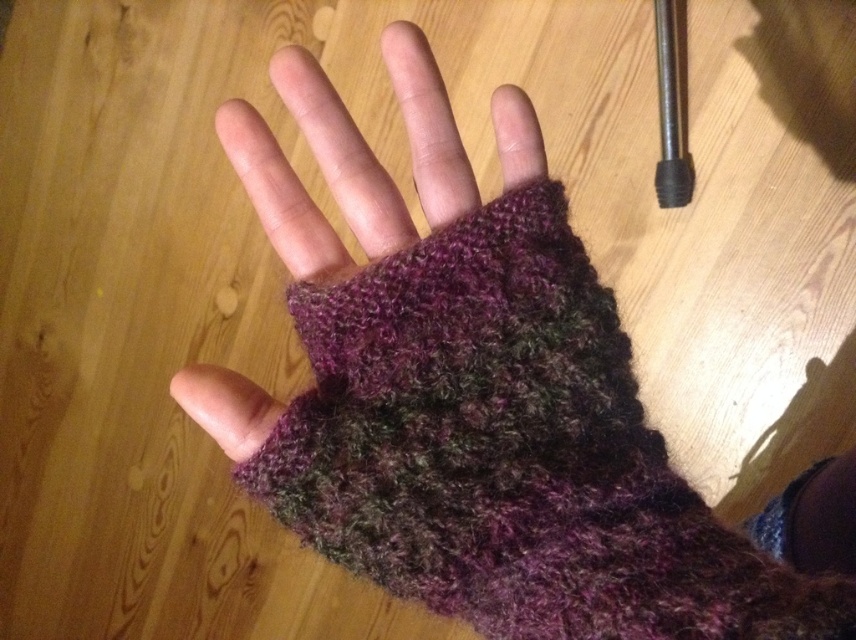
Is multicolor knitted fingerless glove at center shorter than knitted wool sock at lower right?

No, multicolor knitted fingerless glove at center is not shorter than knitted wool sock at lower right.

Can you confirm if multicolor knitted fingerless glove at center is positioned above knitted wool sock at lower right?

Correct, multicolor knitted fingerless glove at center is located above knitted wool sock at lower right.

Does point (503, 397) come in front of point (817, 464)?

Yes, it is.

Where is `multicolor knitted fingerless glove at center`? multicolor knitted fingerless glove at center is located at coordinates (510, 451).

Can you confirm if multicolor knitted fingerless glove at center is taller than fuzzy woolen fingerless glove at center?

Yes.

Is multicolor knitted fingerless glove at center behind fuzzy woolen fingerless glove at center?

No, it is not.

Which is in front, point (734, 550) or point (428, 122)?

Point (734, 550) is in front.

Where is `multicolor knitted fingerless glove at center`? Image resolution: width=856 pixels, height=640 pixels. multicolor knitted fingerless glove at center is located at coordinates (510, 451).

Which is behind, point (257, 410) or point (840, 532)?

Point (840, 532)

Who is more forward, (342, 129) or (771, 528)?

Point (342, 129)

You are a GUI agent. You are given a task and a screenshot of the screen. Output one action in this format:
    pyautogui.click(x=<x>, y=<y>)
    Task: Click on the fuzzy woolen fingerless glove at center
    
    Given the screenshot: What is the action you would take?
    pyautogui.click(x=342, y=154)

Where is `fuzzy woolen fingerless glove at center`? This screenshot has height=640, width=856. fuzzy woolen fingerless glove at center is located at coordinates (342, 154).